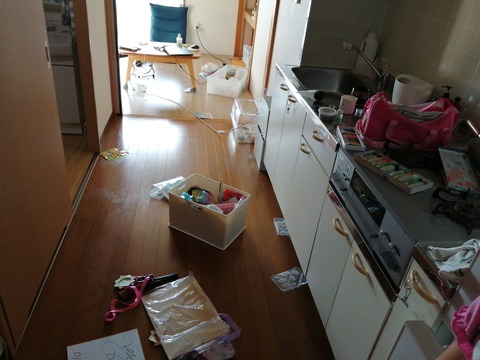
This screenshot has width=480, height=360. Find the location of `walls`. walls is located at coordinates (32, 109), (101, 74), (216, 22), (404, 34).